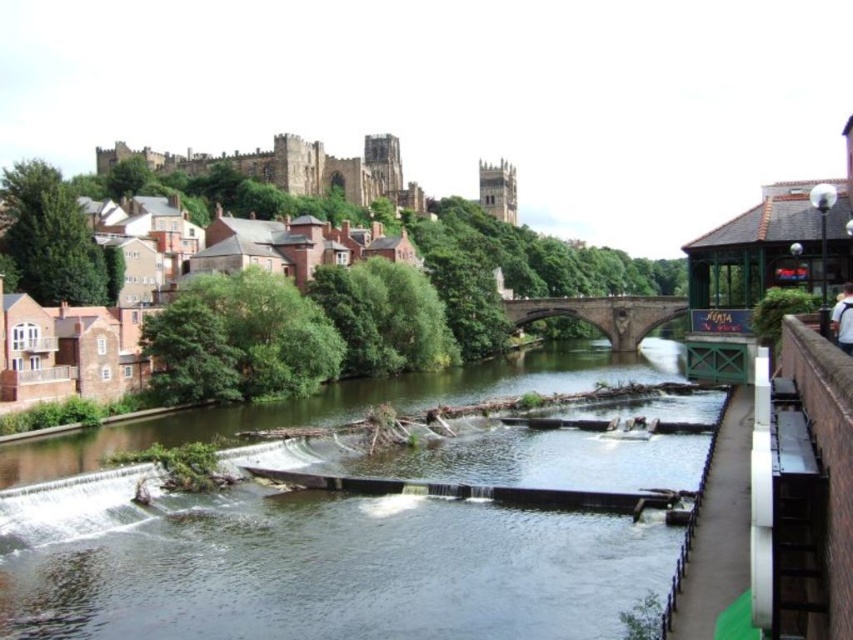
You are a tourist standing on the brown stone bridge at center. Looking down, you see the smooth concrete river at center flowing beneath you. Which object is located directly underneath your feet?

The smooth concrete river at center is directly underneath your feet since it is positioned below the brown stone bridge at center.